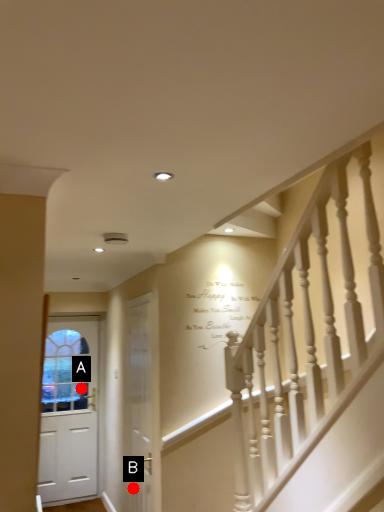
Question: Two points are circled on the image, labeled by A and B beside each circle. Which point is closer to the camera taking this photo?

Choices:
 (A) A is closer
 (B) B is closer

Answer: (B)